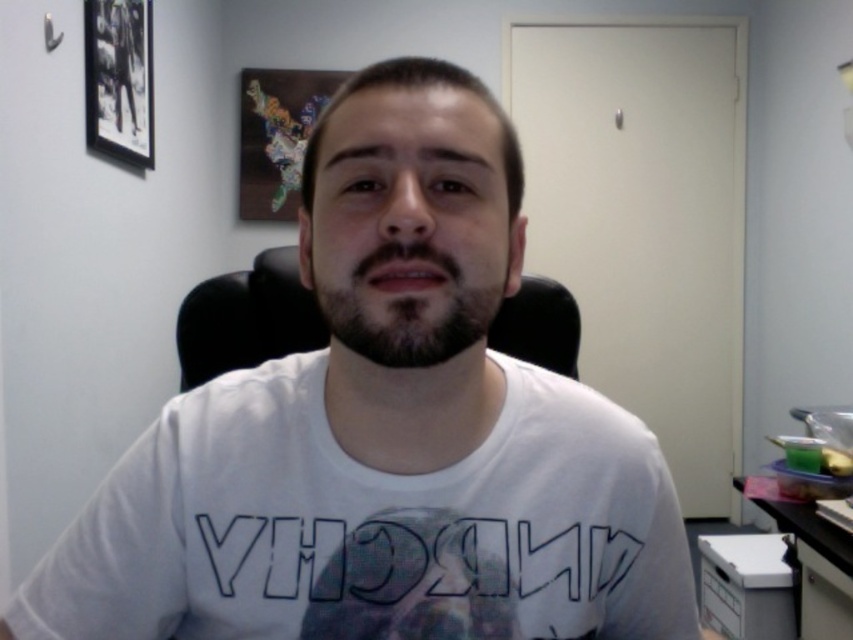
Question: Which point is closer to the camera taking this photo?

Choices:
 (A) (347, 276)
 (B) (186, 385)

Answer: (A)

Question: Is the position of dark brown fuzzy beard at center more distant than that of white plastic table at lower right?

Choices:
 (A) no
 (B) yes

Answer: (A)

Question: Is black leather chair at center bigger than white plastic table at lower right?

Choices:
 (A) no
 (B) yes

Answer: (A)

Question: Which point is closer to the camera?

Choices:
 (A) dark brown fuzzy beard at center
 (B) white cotton t-shirt at center

Answer: (B)

Question: Is white cotton t-shirt at center to the right of dark brown fuzzy beard at center from the viewer's perspective?

Choices:
 (A) yes
 (B) no

Answer: (A)

Question: Among these objects, which one is nearest to the camera?

Choices:
 (A) dark brown fuzzy beard at center
 (B) white cotton t-shirt at center

Answer: (B)